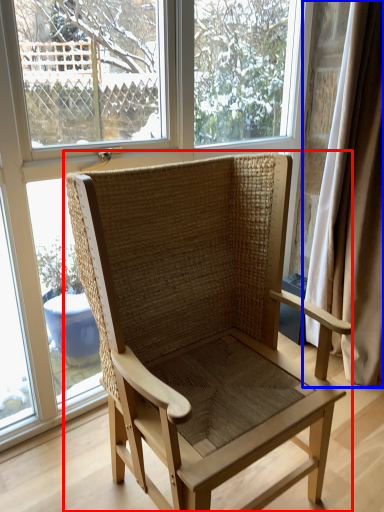
Question: Which object appears closest to the camera in this image, chair (highlighted by a red box) or curtain (highlighted by a blue box)?

Choices:
 (A) chair
 (B) curtain

Answer: (A)